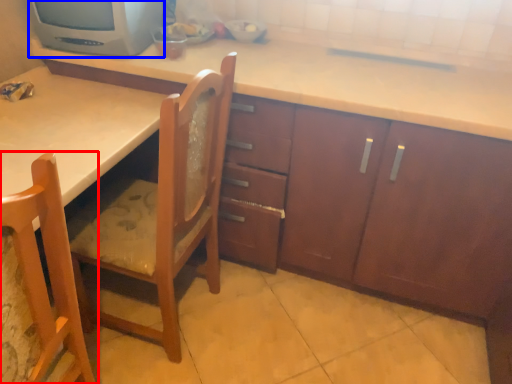
Question: Which of the following is the closest to the observer, chair (highlighted by a red box) or home appliance (highlighted by a blue box)?

Choices:
 (A) chair
 (B) home appliance

Answer: (A)